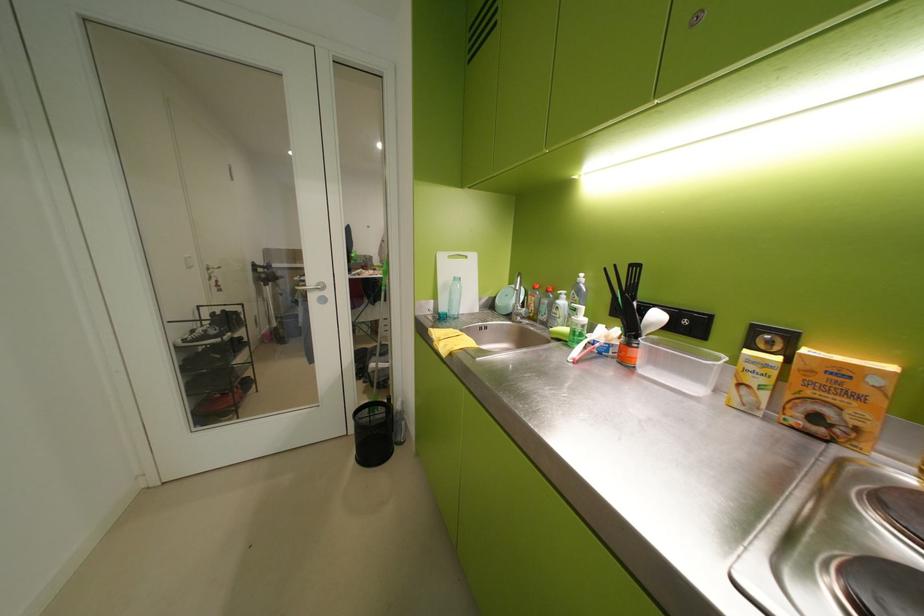
Where is `white pump dispenser`? The height and width of the screenshot is (616, 924). white pump dispenser is located at coordinates tap(578, 314).